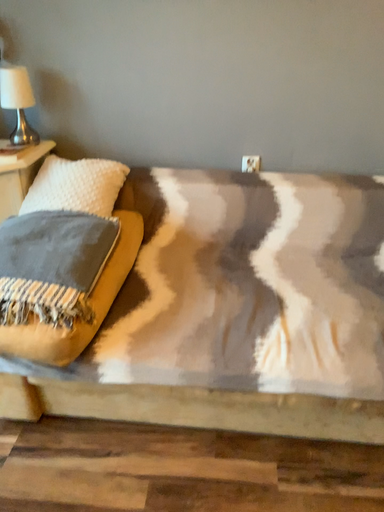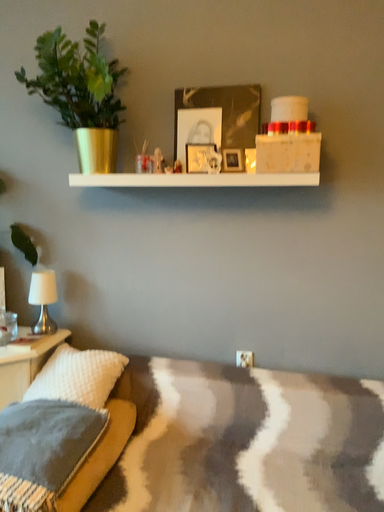
Question: How did the camera likely rotate when shooting the video?

Choices:
 (A) rotated downward
 (B) rotated upward

Answer: (B)